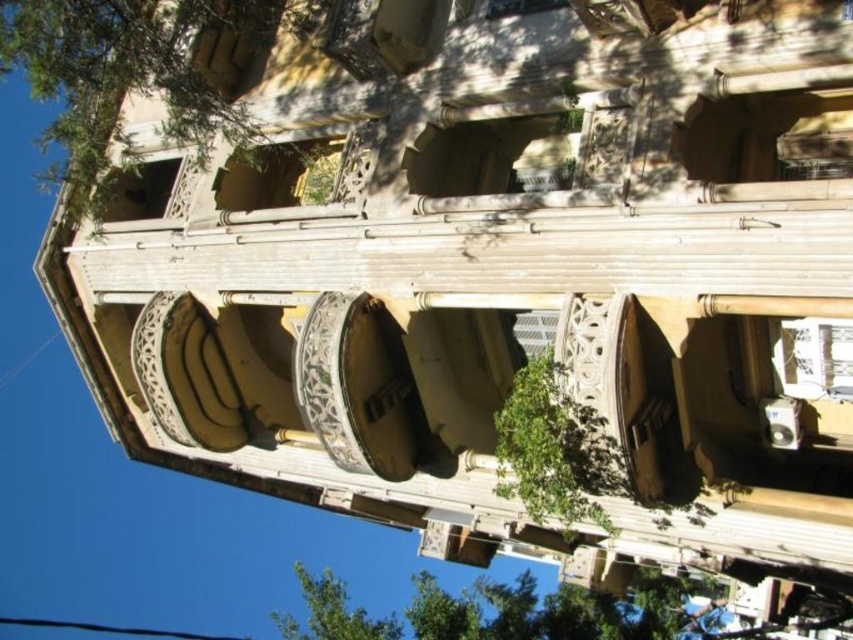
Between green leafy tree at upper left and green leafy tree at center, which one is positioned higher?

green leafy tree at upper left is above.

Is green leafy tree at upper left below green leafy tree at center?

No.

Where is `green leafy tree at upper left`? Image resolution: width=853 pixels, height=640 pixels. green leafy tree at upper left is located at coordinates (138, 74).

Who is positioned more to the right, green leafy tree at lower center or green leafy tree at center?

From the viewer's perspective, green leafy tree at center appears more on the right side.

Is green leafy tree at lower center positioned behind green leafy tree at center?

Yes.

You are a GUI agent. You are given a task and a screenshot of the screen. Output one action in this format:
    pyautogui.click(x=<x>, y=<y>)
    Task: Click on the green leafy tree at lower center
    
    Given the screenshot: What is the action you would take?
    pyautogui.click(x=556, y=611)

Can you confirm if green leafy tree at upper left is positioned to the right of green leafy tree at lower center?

In fact, green leafy tree at upper left is to the left of green leafy tree at lower center.

Can you confirm if green leafy tree at upper left is wider than green leafy tree at lower center?

In fact, green leafy tree at upper left might be narrower than green leafy tree at lower center.

Identify the location of green leafy tree at upper left. (138, 74).